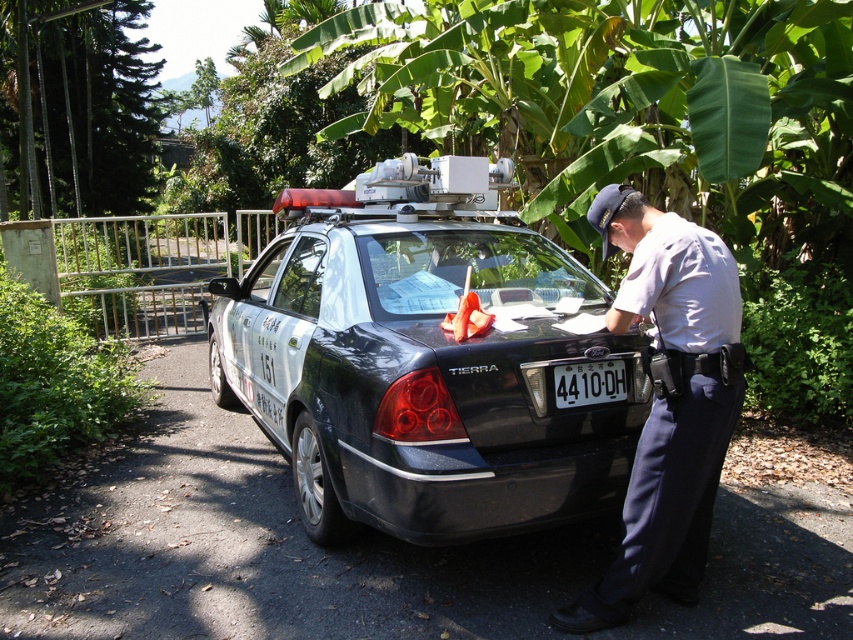
Question: Is white uniform at center thinner than white plastic license plate at center?

Choices:
 (A) yes
 (B) no

Answer: (B)

Question: Which point is farther to the camera?

Choices:
 (A) green leafy banana tree at upper center
 (B) white uniform at center

Answer: (A)

Question: Does green leafy banana tree at upper center lie in front of white uniform at center?

Choices:
 (A) no
 (B) yes

Answer: (A)

Question: Which of the following is the closest to the observer?

Choices:
 (A) green leafy banana tree at upper center
 (B) white uniform at center
 (C) black glossy police car at center
 (D) white plastic license plate at center

Answer: (B)

Question: Does white uniform at center appear on the left side of white plastic license plate at center?

Choices:
 (A) yes
 (B) no

Answer: (B)

Question: Which is nearer to the black glossy police car at center?

Choices:
 (A) white uniform at center
 (B) white plastic license plate at center
 (C) green leafy banana tree at upper center

Answer: (B)